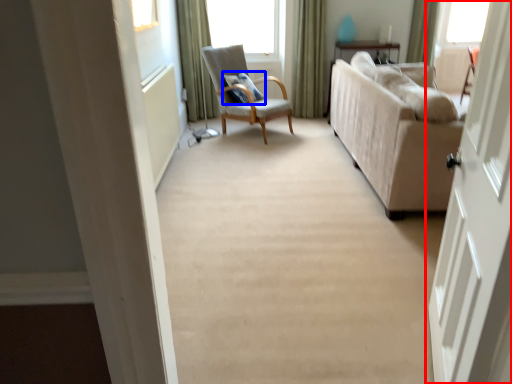
Question: Which of the following is the closest to the observer, door (highlighted by a red box) or pillow (highlighted by a blue box)?

Choices:
 (A) door
 (B) pillow

Answer: (A)